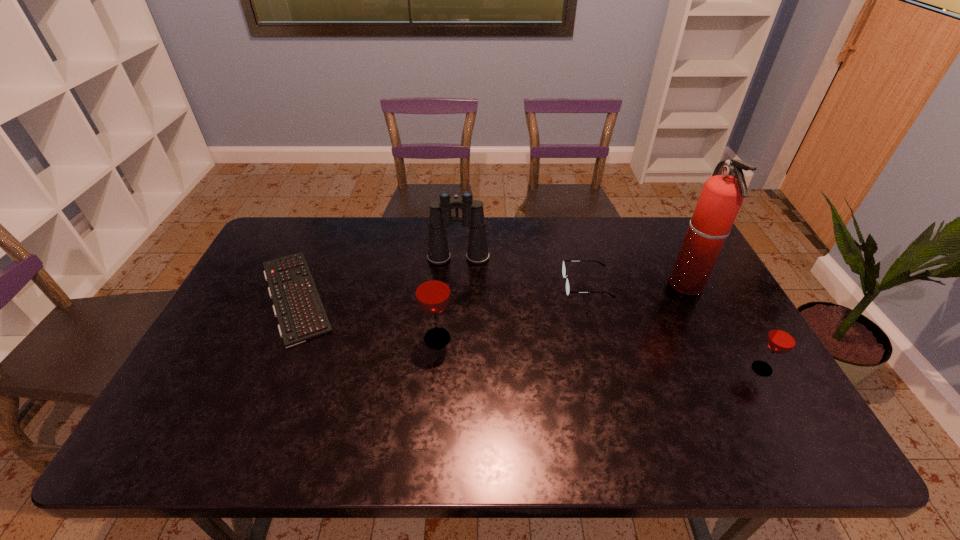
At what (x,y) coordinates should I click in order to perform the action: click on vacant space situated 0.370m on the right of the binoculars. Please return your answer as a coordinate pair (x, y). The width and height of the screenshot is (960, 540). Looking at the image, I should click on (602, 258).

Find the location of a particular element. computer keyboard present at the far edge is located at coordinates (297, 305).

Where is `binoculars present at the far edge`? binoculars present at the far edge is located at coordinates (440, 218).

Locate an element on the screen. Image resolution: width=960 pixels, height=540 pixels. object that is at the left edge is located at coordinates (297, 305).

The height and width of the screenshot is (540, 960). I want to click on glass present at the right edge, so click(x=782, y=338).

Locate an element on the screen. This screenshot has width=960, height=540. fire extinguisher located in the right edge section of the desktop is located at coordinates (722, 195).

The height and width of the screenshot is (540, 960). Identify the location of object that is at the far left corner. (297, 305).

I want to click on vacant space at the far edge, so click(424, 253).

This screenshot has width=960, height=540. In order to click on vacant position at the near edge of the desktop in this screenshot , I will do `click(628, 403)`.

This screenshot has height=540, width=960. In the image, there is a desktop. Find the location of `free space at the left edge`. free space at the left edge is located at coordinates (206, 381).